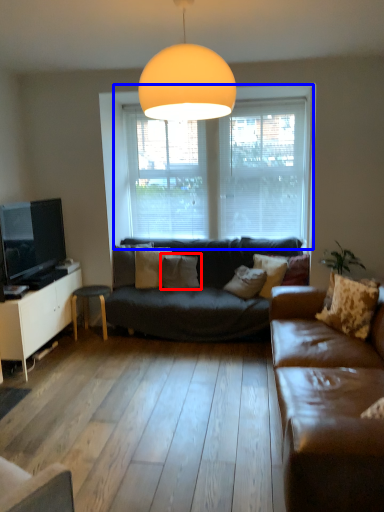
Question: Which of the following is the closest to the observer, pillow (highlighted by a red box) or window (highlighted by a blue box)?

Choices:
 (A) pillow
 (B) window

Answer: (A)